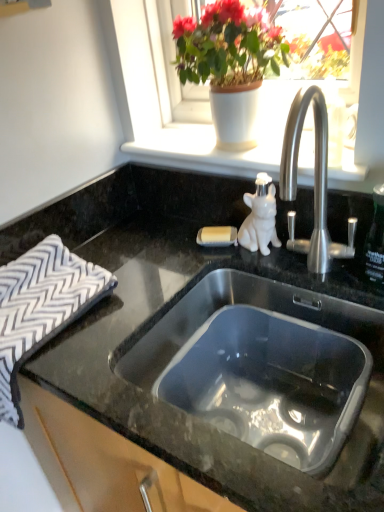
Question: Considering the positions of black granite countertop at center and white matte window sill at upper center in the image, is black granite countertop at center wider or thinner than white matte window sill at upper center?

Choices:
 (A) thin
 (B) wide

Answer: (B)

Question: From the image's perspective, is black granite countertop at center located above or below white matte window sill at upper center?

Choices:
 (A) below
 (B) above

Answer: (A)

Question: Which object is the closest to the matte white pot at upper center?

Choices:
 (A) stainless steel sink at center
 (B) white zigzag-patterned cloth at left
 (C) white matte window sill at upper center
 (D) black granite countertop at center

Answer: (C)

Question: Estimate the real-world distances between objects in this image. Which object is farther from the matte white pot at upper center?

Choices:
 (A) white zigzag-patterned cloth at left
 (B) white matte window sill at upper center
 (C) stainless steel sink at center
 (D) black granite countertop at center

Answer: (A)